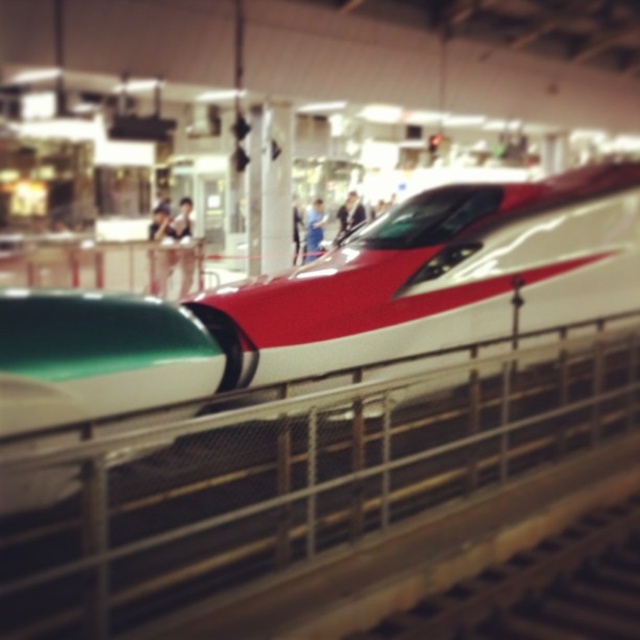
Question: Can you confirm if blue fabric person at center is positioned to the right of smooth fabric shirt at center?

Choices:
 (A) yes
 (B) no

Answer: (B)

Question: Which is farther from the shiny metallic train at center?

Choices:
 (A) blue fabric person at center
 (B) smooth fabric shirt at center

Answer: (B)

Question: Estimate the real-world distances between objects in this image. Which object is closer to the smooth fabric shirt at center?

Choices:
 (A) white glossy rail at center
 (B) shiny metallic train at center

Answer: (B)

Question: Can you confirm if blue fabric person at center is smaller than smooth fabric shirt at center?

Choices:
 (A) yes
 (B) no

Answer: (A)

Question: Which object appears closest to the camera in this image?

Choices:
 (A) blue fabric person at center
 (B) smooth fabric shirt at center
 (C) shiny metallic train at center

Answer: (C)

Question: Does white glossy rail at center have a greater width compared to smooth fabric shirt at center?

Choices:
 (A) yes
 (B) no

Answer: (A)